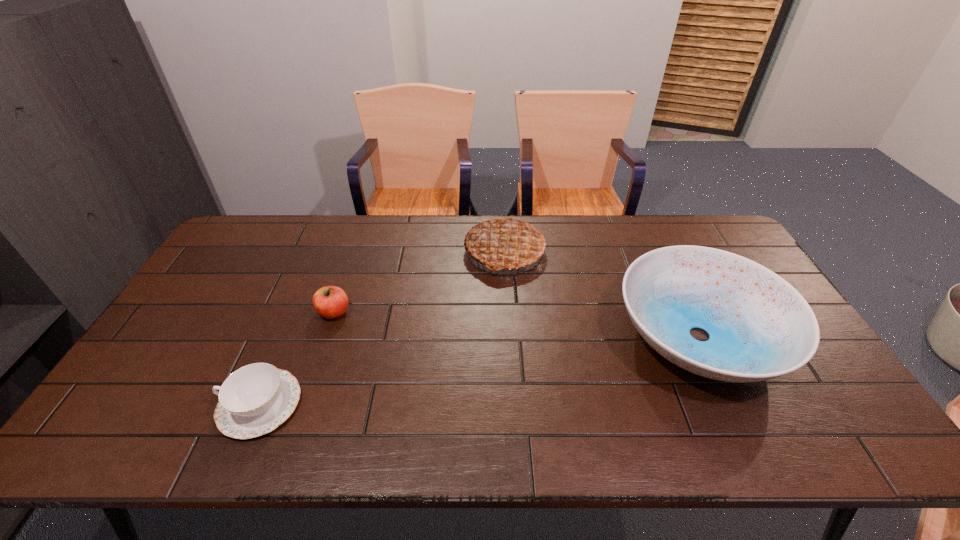
You are a GUI agent. You are given a task and a screenshot of the screen. Output one action in this format:
    pyautogui.click(x=<x>, y=<y>)
    Task: Click on the vacant space located on the handle side of the chinaware
    This screenshot has width=960, height=540.
    Given the screenshot: What is the action you would take?
    pyautogui.click(x=171, y=404)

This screenshot has height=540, width=960. I want to click on free spot located 0.220m on the handle side of the chinaware, so click(x=130, y=404).

Locate an element on the screen. The image size is (960, 540). object located in the far edge section of the desktop is located at coordinates [x=507, y=243].

The height and width of the screenshot is (540, 960). Find the location of `object that is at the near edge`. object that is at the near edge is located at coordinates (254, 400).

Locate an element on the screen. Image resolution: width=960 pixels, height=540 pixels. object at the right edge is located at coordinates (760, 327).

The width and height of the screenshot is (960, 540). What are the coordinates of `vacant area at the far edge of the desktop` in the screenshot? It's located at point(626,236).

Find the location of a particular element. free space at the near edge of the desktop is located at coordinates (492, 430).

In the image, there is a desktop. In order to click on vacant space at the right edge in this screenshot , I will do `click(828, 388)`.

This screenshot has width=960, height=540. What are the coordinates of `blank space at the near left corner` in the screenshot? It's located at (154, 435).

Image resolution: width=960 pixels, height=540 pixels. Identify the location of empty space that is in between the chinaware and the pie. (382, 328).